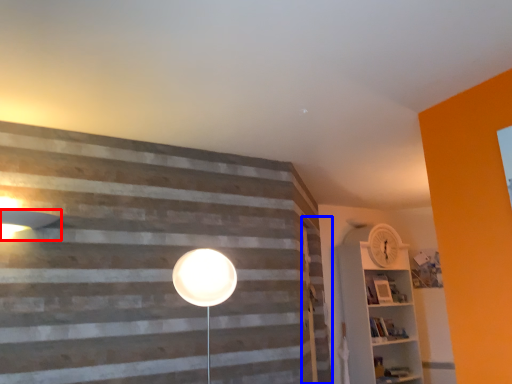
Question: Which point is further to the camera, lamp (highlighted by a red box) or barn door (highlighted by a blue box)?

Choices:
 (A) lamp
 (B) barn door

Answer: (B)